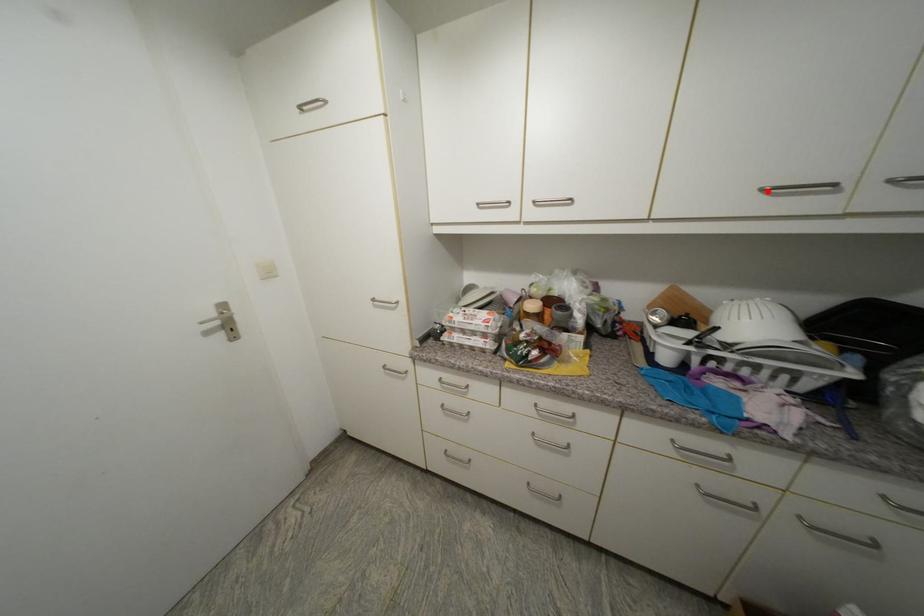
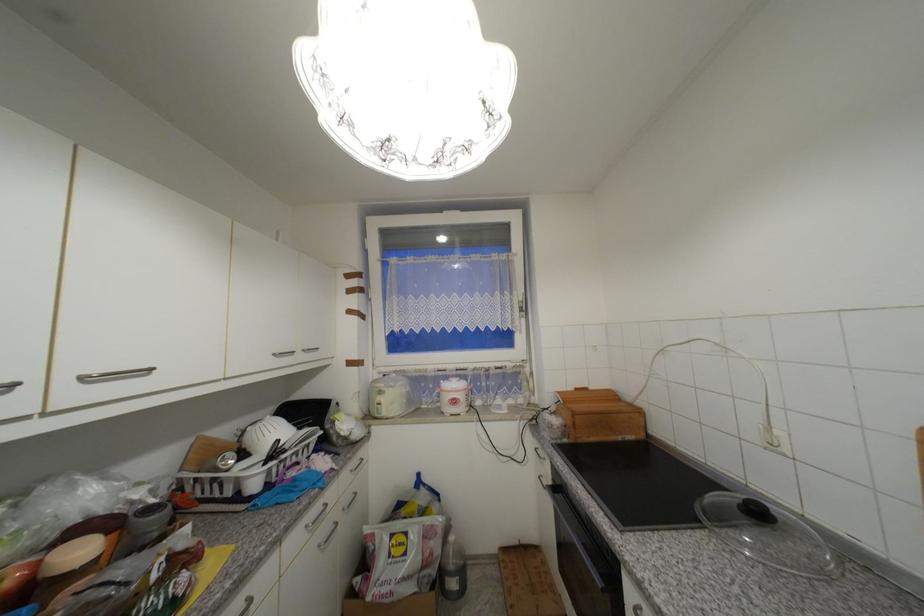
The point at the highlighted location is marked in the first image. Where is the corresponding point in the second image?

(281, 355)